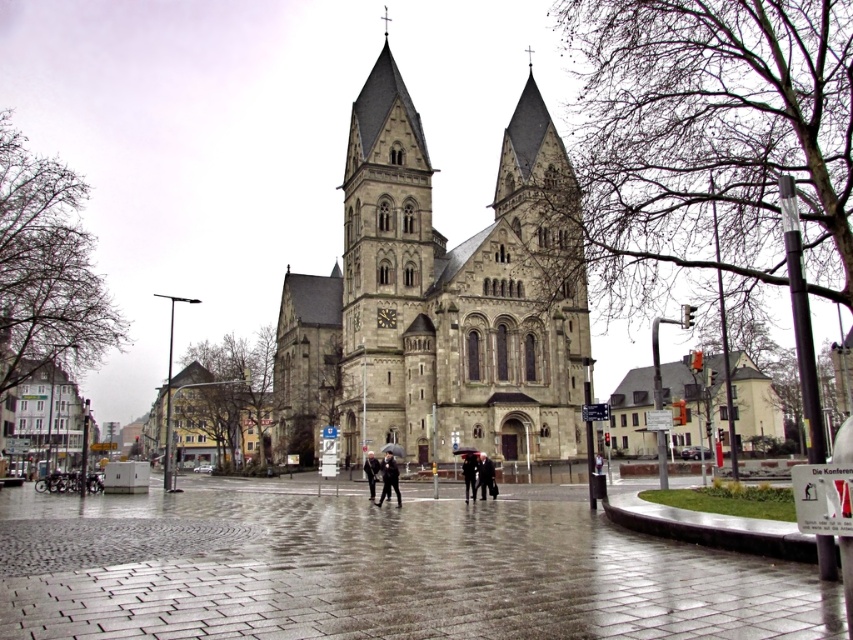
From the picture: You are standing on the wet cobblestone plaza in front of the gray stone church at center. You want to take a photo of the church without any obstructions. Is the dark gray fabric umbrella at center blocking your view of the church?

The dark gray fabric umbrella at center is behind the gray stone church at center, so it is not blocking your view of the church.

You are standing on the wet cobblestone plaza in front of the gray stone church at center. You notice a dark gray coat at center. Which object is bigger in size?

The gray stone church at center is larger in size than the dark gray coat at center.